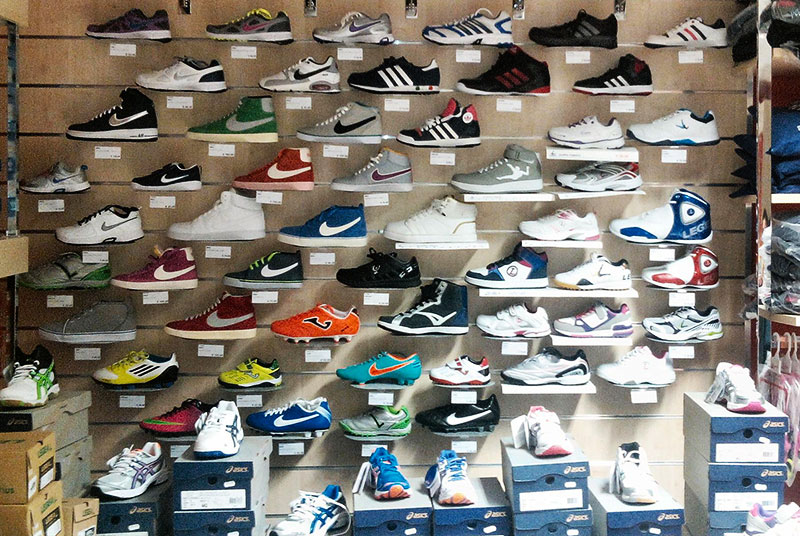
The width and height of the screenshot is (800, 536). Identify the location of shoes on top of shoeboxes. (32, 379), (126, 471), (216, 446), (322, 516), (386, 481), (444, 481), (546, 442), (624, 480), (742, 398), (774, 518).